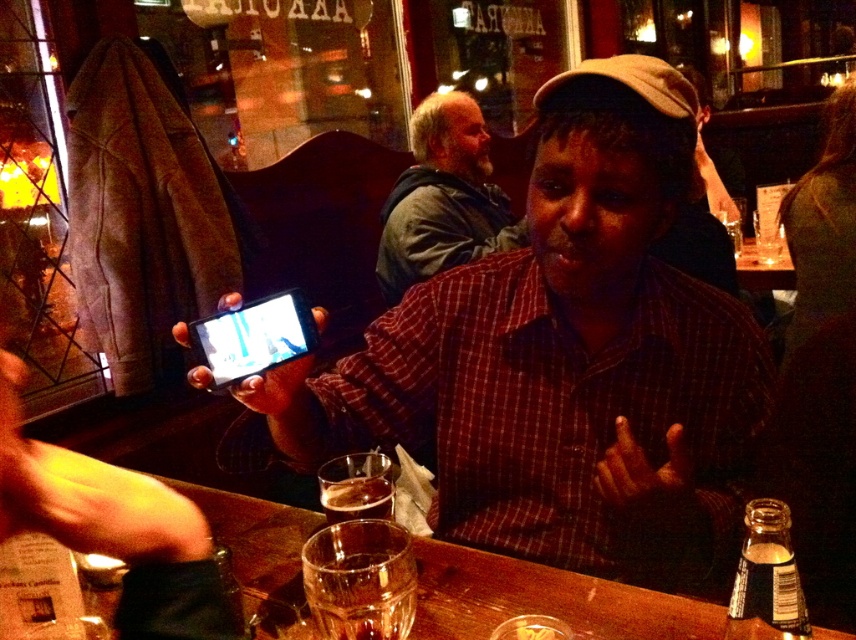
You are a bartender who needs to place a new drink order. The transparent glass at lower center and the bearded man at center are in your line of sight. Which object can you place a coaster under to prevent spills?

The transparent glass at lower center can have a coaster placed under it since it is an object, while the bearded man at center is a person and cannot have a coaster placed under them.

Looking at this image, you are a bartender in this bar scene. You need to place a coaster under the transparent glass at lower center to prevent damage to the wooden table. However, the matte black phone at center is blocking the area where you want to place it. Can you move the phone to make space?

The matte black phone at center is much taller than the transparent glass at lower center. Since the phone is taller, it might cast a larger shadow or occupy more vertical space, but since you need horizontal space to place the coaster under the glass, the height difference doesn